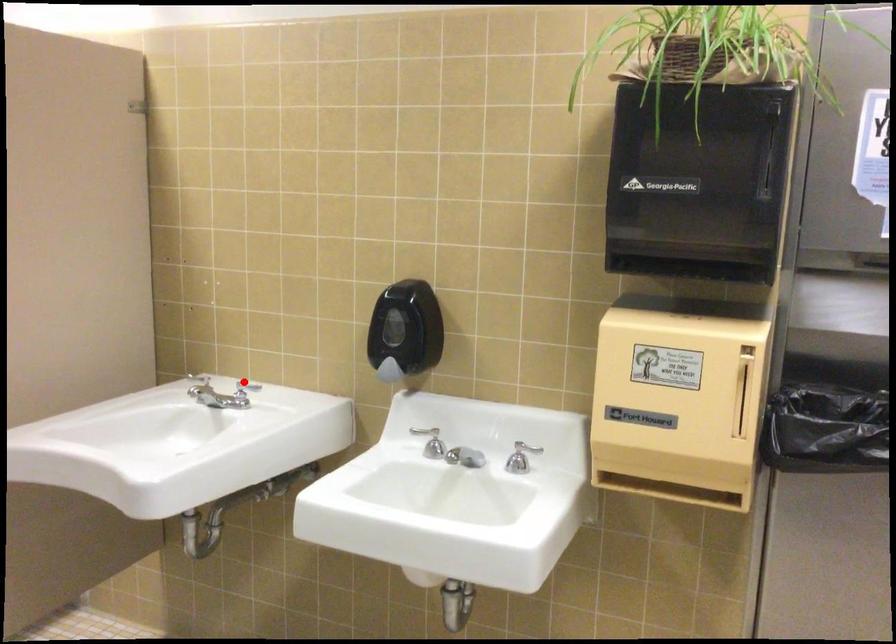
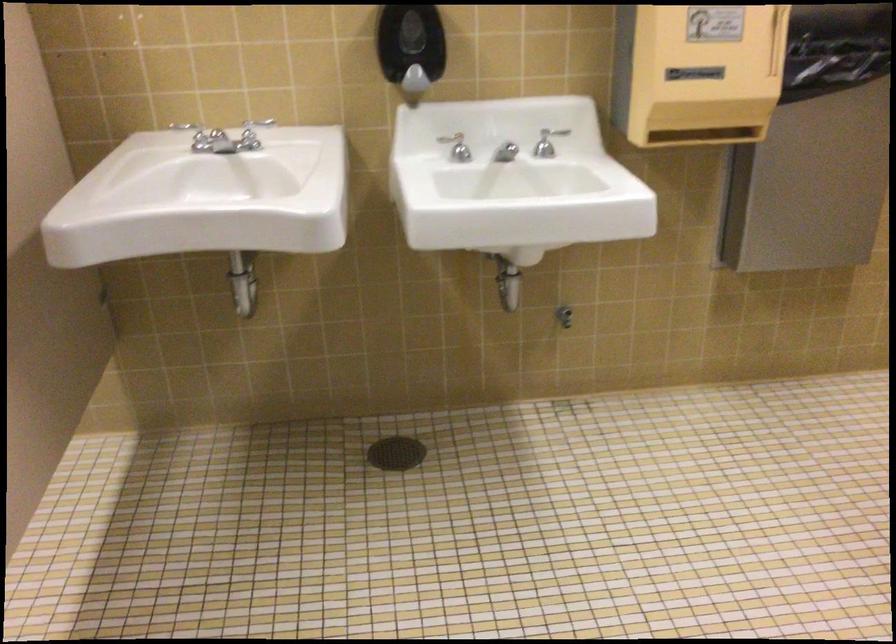
Question: I am providing you with two images of the same scene from different viewpoints. Image1 has a red point marked. In image2, the corresponding 3D location appears at what relative position? Reply with the corresponding letter.

Choices:
 (A) Closer
 (B) Farther

Answer: (A)